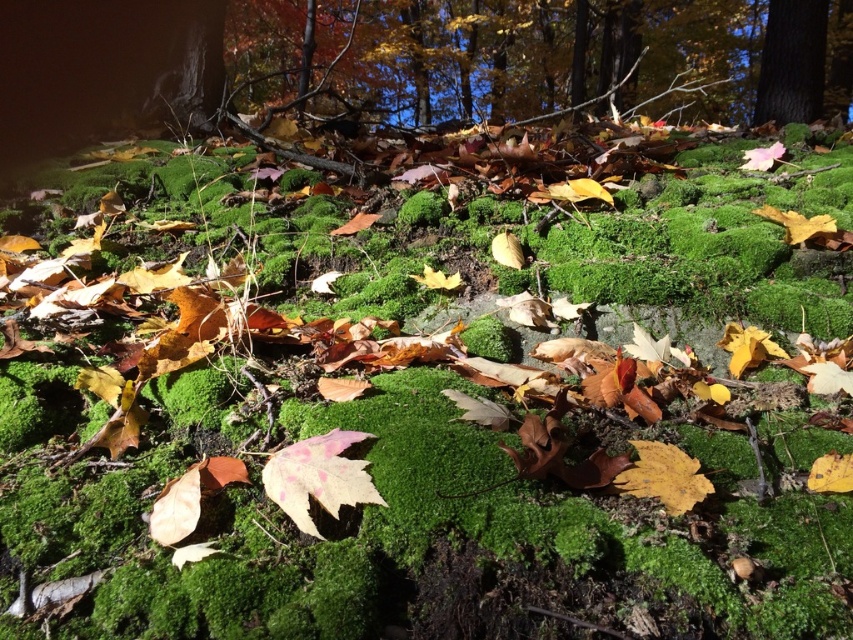
Question: Is autumn leaves at upper center positioned before smooth bark tree at upper right?

Choices:
 (A) no
 (B) yes

Answer: (B)

Question: Does autumn leaves at upper center come behind smooth bark tree at upper right?

Choices:
 (A) yes
 (B) no

Answer: (B)

Question: Can you confirm if autumn leaves at upper center is wider than smooth bark tree at upper right?

Choices:
 (A) no
 (B) yes

Answer: (B)

Question: Which of the following is the farthest from the observer?

Choices:
 (A) (802, 106)
 (B) (523, 70)

Answer: (B)

Question: Which point appears closest to the camera in this image?

Choices:
 (A) (758, 109)
 (B) (457, 56)

Answer: (A)